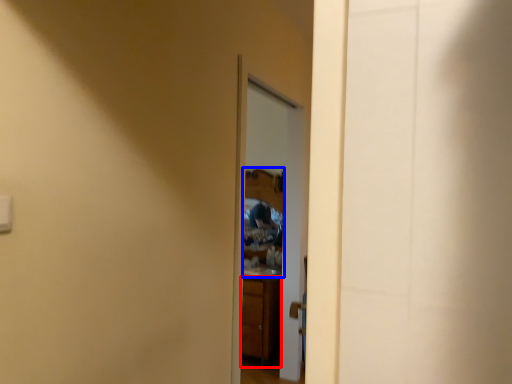
Question: Which point is closer to the camera, cabinetry (highlighted by a red box) or mirror (highlighted by a blue box)?

Choices:
 (A) cabinetry
 (B) mirror

Answer: (B)